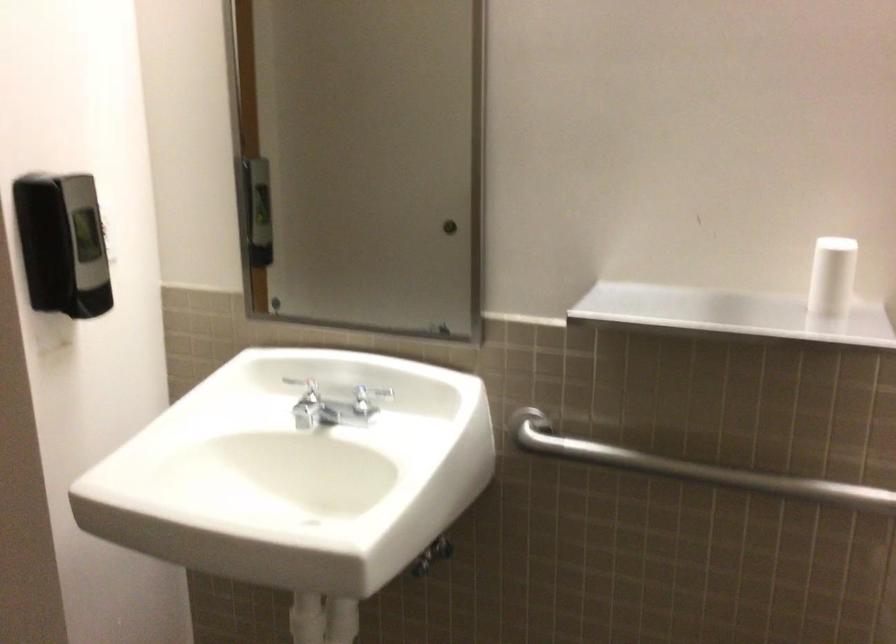
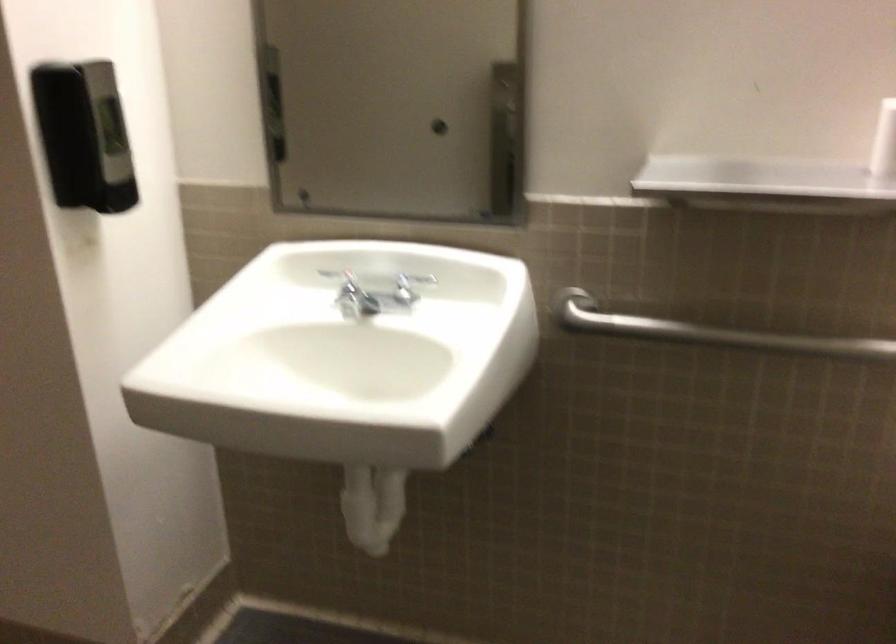
In the second image, find the point that corresponds to (x=819, y=281) in the first image.

(883, 142)